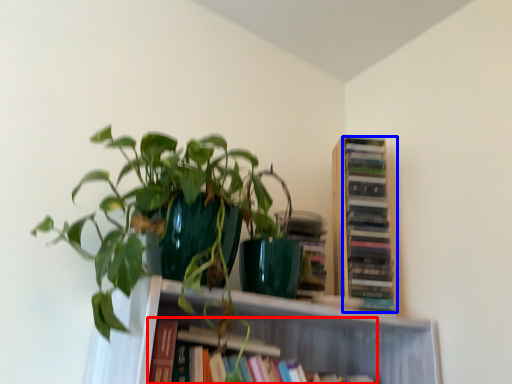
Question: Which object is closer to the camera taking this photo, book (highlighted by a red box) or book (highlighted by a blue box)?

Choices:
 (A) book
 (B) book

Answer: (A)